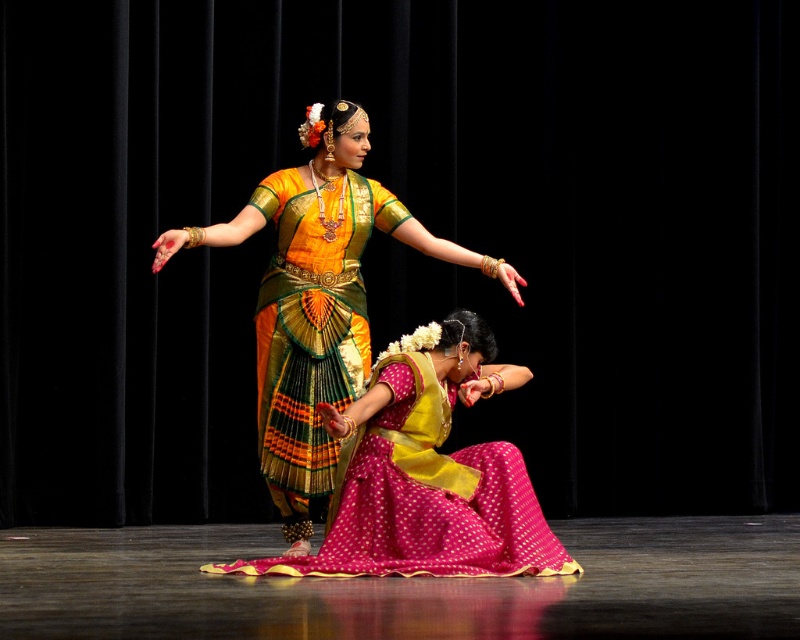
You are a photographer who needs to capture the golden silk saree at center and the shiny silk saree at center in a single frame. Which saree should you focus on first to ensure it appears larger in the photo?

The golden silk saree at center is taller than the shiny silk saree at center, so focusing on it first will ensure it appears larger in the photo.

You are a photographer at the back of the stage. You want to capture a photo of both the pink satin saree at center and the shiny silk saree at center. Which saree should you focus on first to ensure the one in front is in focus?

The pink satin saree at center is below the shiny silk saree at center, so you should focus on the shiny silk saree at center first as it is in front.